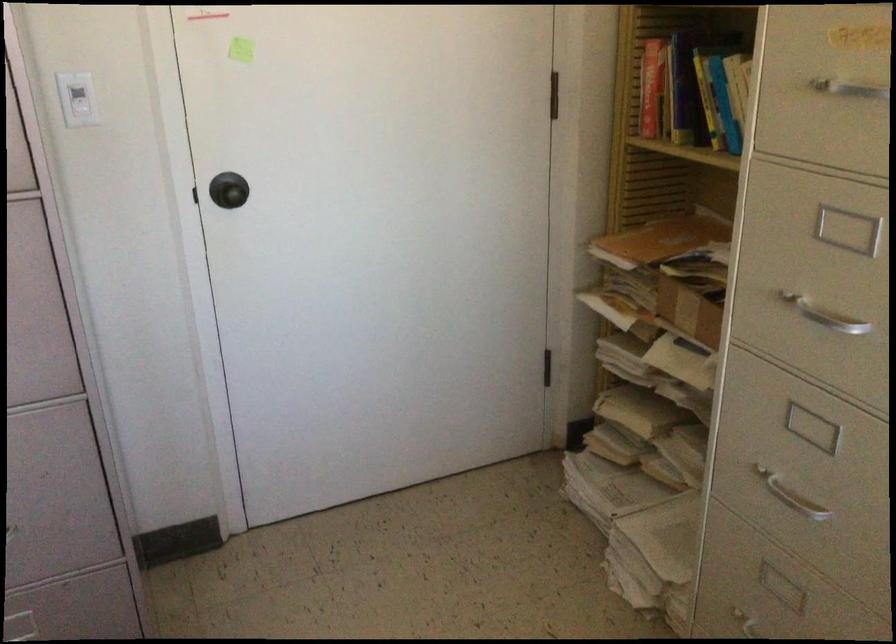
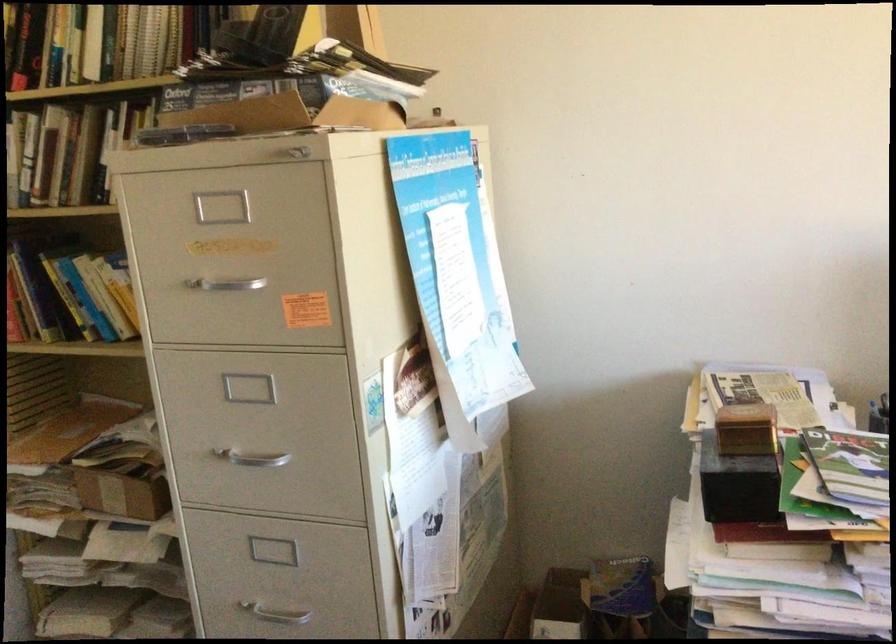
Question: The camera is either moving clockwise (left) or counter-clockwise (right) around the object. The first image is from the beginning of the video and the second image is from the end. Is the camera moving left or right when shooting the video?

Choices:
 (A) Left
 (B) Right

Answer: (A)